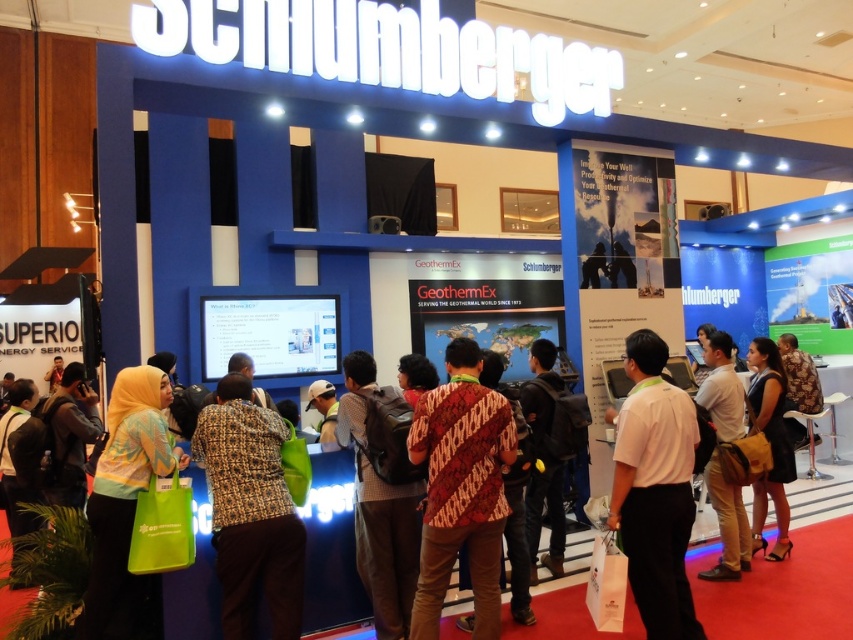
Does point (235, 384) come farther from viewer compared to point (640, 477)?

Yes.

Based on the photo, between printed fabric shirt at center and white shirt at center, which one is positioned higher?

white shirt at center is above.

Between point (224, 442) and point (672, 403), which one is positioned in front?

Point (224, 442) is in front.

The image size is (853, 640). Find the location of `printed fabric shirt at center`. printed fabric shirt at center is located at coordinates (250, 512).

Between point (364, 536) and point (778, 378), which one is positioned in front?

Point (364, 536)

Describe the element at coordinates (379, 506) in the screenshot. I see `brown woven backpack at center` at that location.

Between point (361, 476) and point (775, 385), which one is positioned behind?

Point (775, 385)

At what (x,y) coordinates should I click in order to perform the action: click on brown woven backpack at center. Please return your answer as a coordinate pair (x, y). This screenshot has height=640, width=853. Looking at the image, I should click on (379, 506).

Is dark brown leather backpack at center behind white fabric cap at center?

That is True.

Is point (553, 483) closer to camera compared to point (332, 422)?

Yes.

What do you see at coordinates (543, 458) in the screenshot? I see `dark brown leather backpack at center` at bounding box center [543, 458].

Locate an element on the screen. dark brown leather backpack at center is located at coordinates (543, 458).